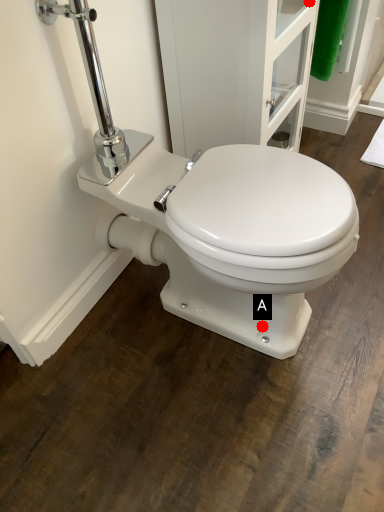
Question: Two points are circled on the image, labeled by A and B beside each circle. Which point is further to the camera?

Choices:
 (A) A is further
 (B) B is further

Answer: (B)